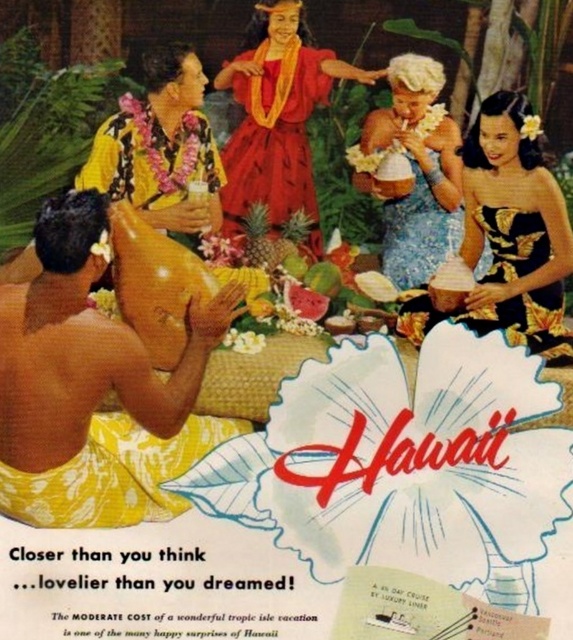
Question: Considering the relative positions of black satin dress at center and matte yellow shirt at upper left in the image provided, where is black satin dress at center located with respect to matte yellow shirt at upper left?

Choices:
 (A) left
 (B) right

Answer: (B)

Question: Is yellow woven cloth at left further to the viewer compared to matte yellow shirt at upper left?

Choices:
 (A) yes
 (B) no

Answer: (B)

Question: Considering the real-world distances, which object is closest to the black satin dress at center?

Choices:
 (A) matte yellow shirt at upper left
 (B) yellow woven cloth at left
 (C) blue floral dress at center

Answer: (C)

Question: Among these objects, which one is nearest to the camera?

Choices:
 (A) blue floral dress at center
 (B) shiny red fabric dress at center
 (C) matte yellow shirt at upper left
 (D) black satin dress at center

Answer: (D)

Question: Is the position of yellow woven cloth at left more distant than that of matte yellow shirt at upper left?

Choices:
 (A) yes
 (B) no

Answer: (B)

Question: Which point is closer to the camera?

Choices:
 (A) matte yellow shirt at upper left
 (B) black satin dress at center
 (C) blue floral dress at center

Answer: (B)